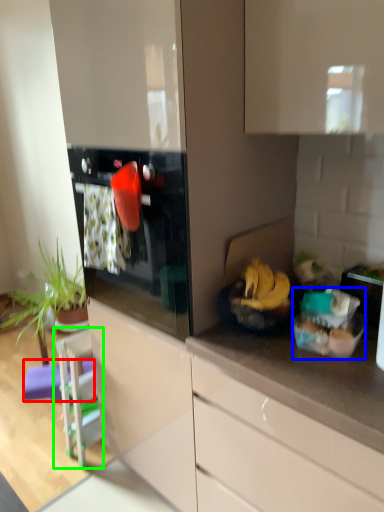
Question: Based on their relative distances, which object is nearer to bar stool (highlighted by a red box)? Choose from food (highlighted by a blue box) and appliance (highlighted by a green box).

Choices:
 (A) food
 (B) appliance

Answer: (B)